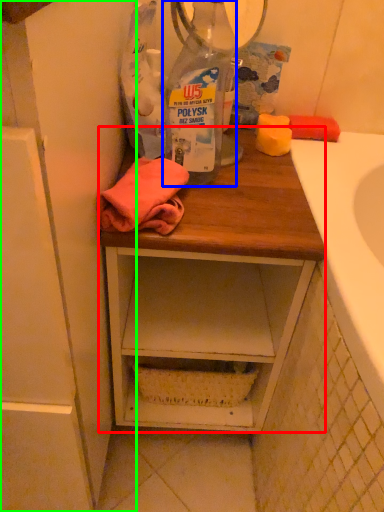
Question: Which is nearer to the desk (highlighted by a red box)? bottle (highlighted by a blue box) or cabinetry (highlighted by a green box).

Choices:
 (A) bottle
 (B) cabinetry

Answer: (B)